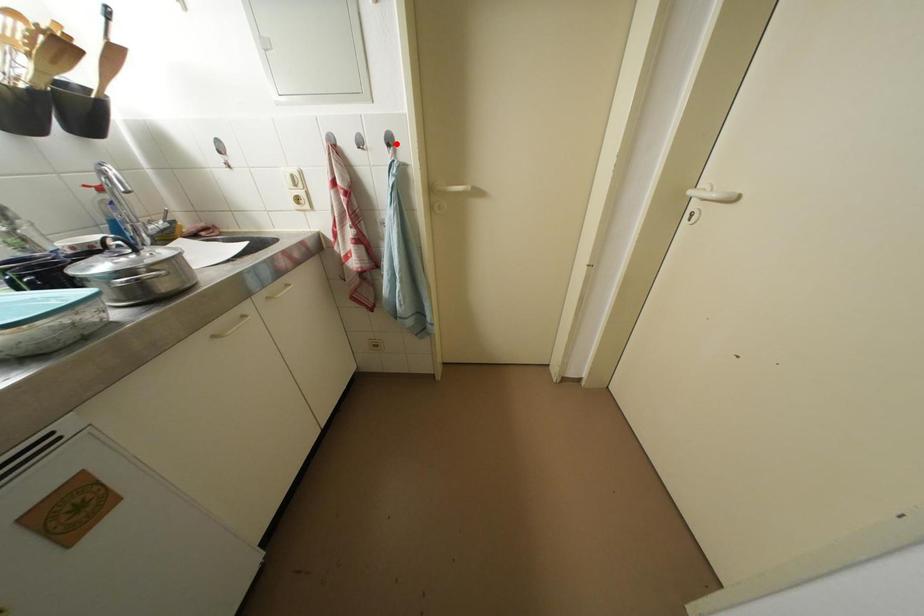
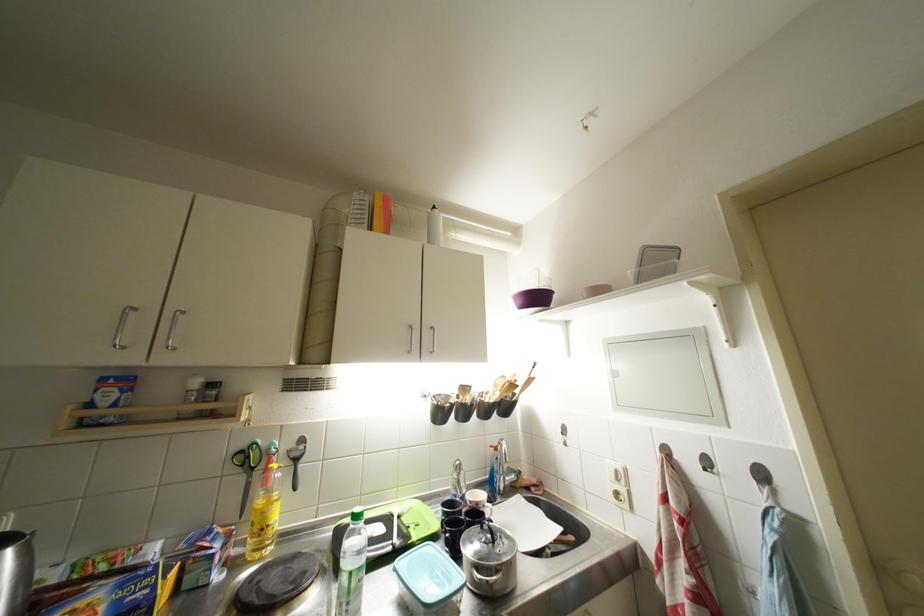
Locate, in the second image, the point that corresponds to the highlighted location in the first image.

(769, 479)